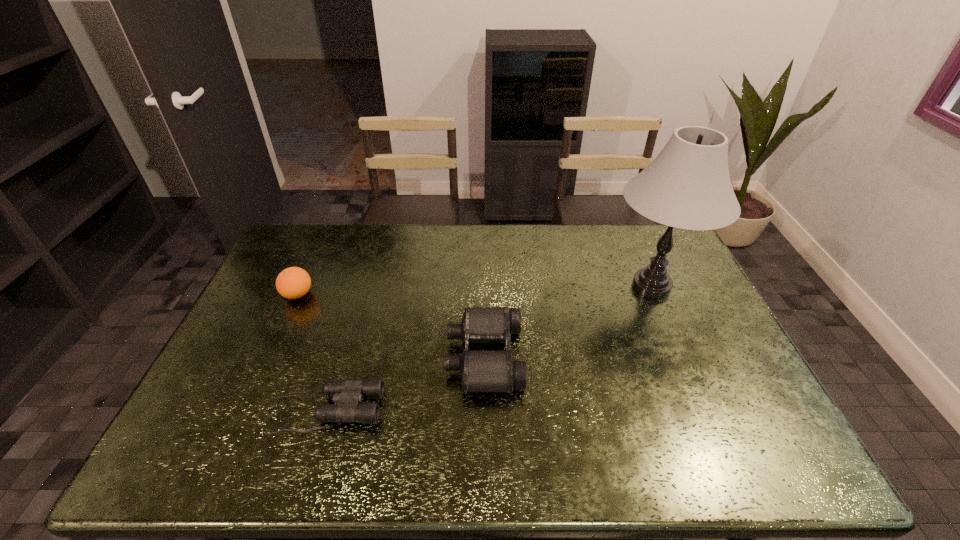
Identify the location of free space between the lamp and the leftmost object. Image resolution: width=960 pixels, height=540 pixels. (474, 291).

Find the location of a particular element. This screenshot has width=960, height=540. free space between the third object from right to left and the lamp is located at coordinates (488, 348).

Locate an element on the screen. The height and width of the screenshot is (540, 960). object that ranks as the closest to the right binoculars is located at coordinates (348, 394).

At what (x,y) coordinates should I click in order to perform the action: click on object that stands as the second closest to the shorter binoculars. Please return your answer as a coordinate pair (x, y). This screenshot has width=960, height=540. Looking at the image, I should click on (292, 283).